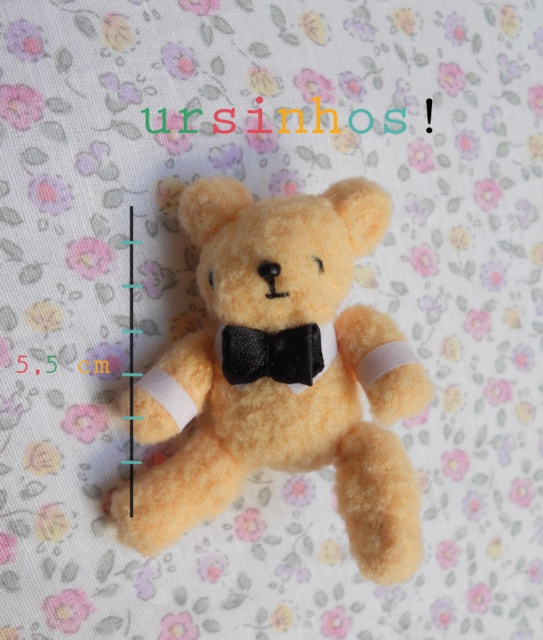
Question: Does fuzzy yellow teddy bear at center have a smaller size compared to black satin bow tie at center?

Choices:
 (A) yes
 (B) no

Answer: (B)

Question: Is fuzzy yellow teddy bear at center to the right of black satin bow tie at center from the viewer's perspective?

Choices:
 (A) yes
 (B) no

Answer: (B)

Question: Is the position of fuzzy yellow teddy bear at center more distant than that of black satin bow tie at center?

Choices:
 (A) yes
 (B) no

Answer: (B)

Question: Which point appears farthest from the camera in this image?

Choices:
 (A) (222, 362)
 (B) (260, 205)

Answer: (B)

Question: Which point is closer to the camera taking this photo?

Choices:
 (A) (294, 243)
 (B) (287, 378)

Answer: (A)